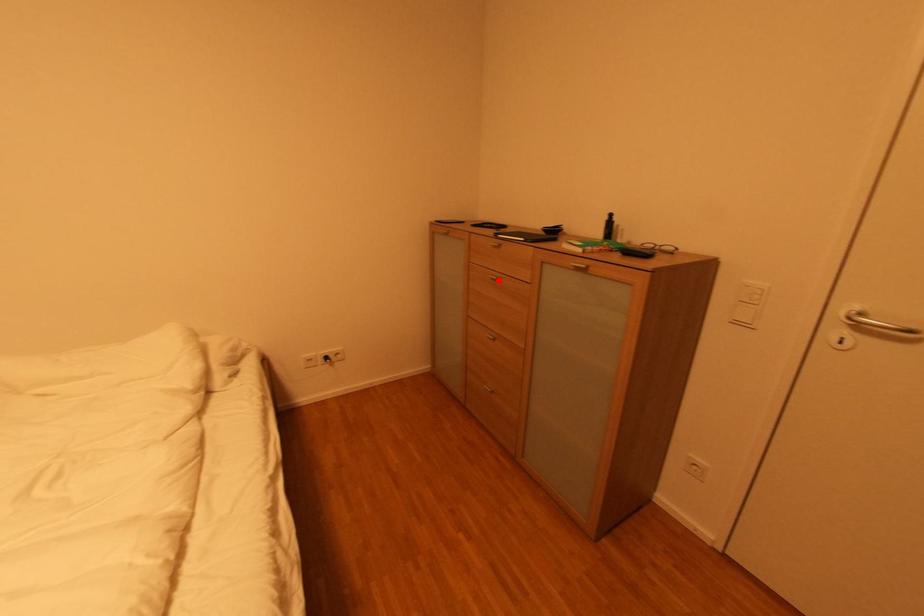
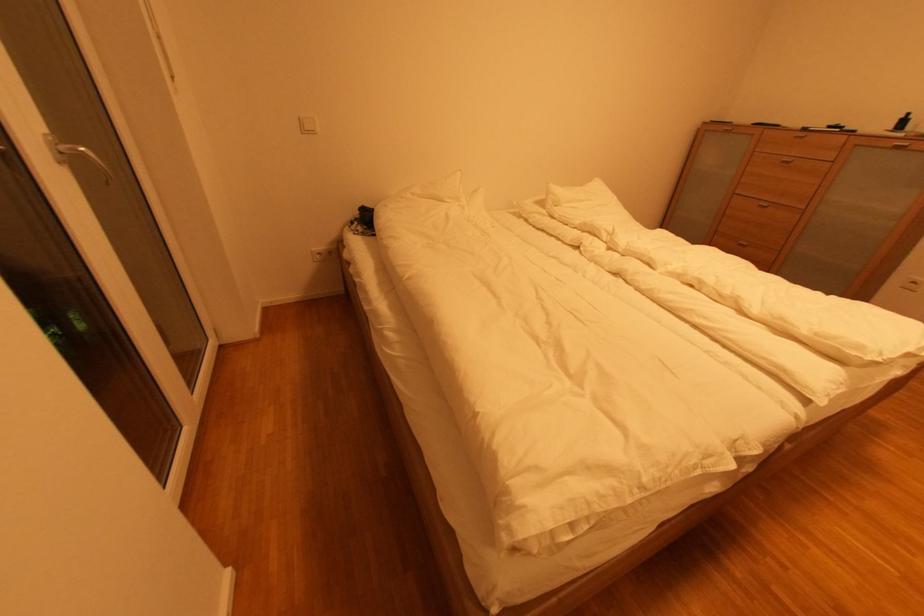
Question: I am providing you with two images of the same scene from different viewpoints. A red point is shown in image1. For the corresponding object point in image2, is it positioned nearer or farther from the camera?

Choices:
 (A) Nearer
 (B) Farther

Answer: (B)